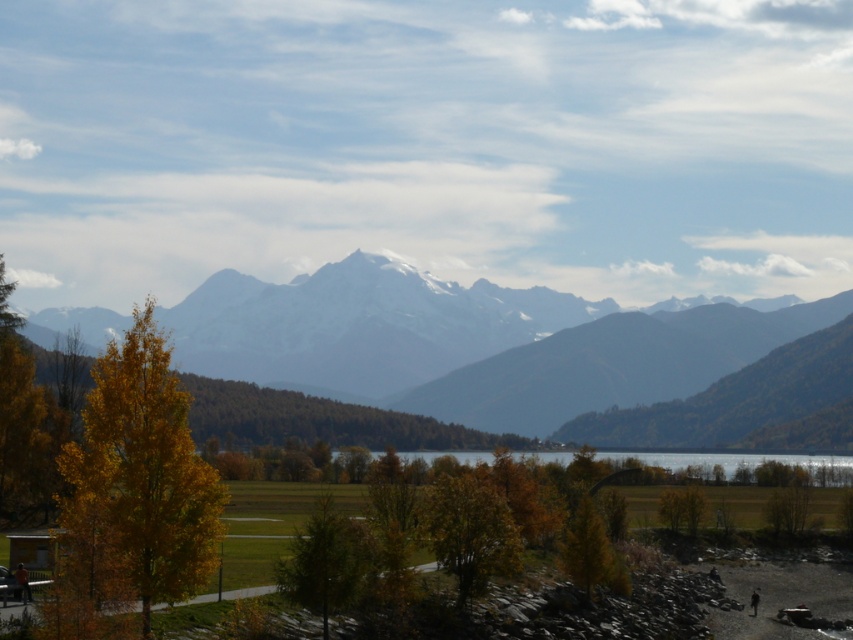
Is green matte tree at center taller than yellow matte tree at lower center?

Yes, green matte tree at center is taller than yellow matte tree at lower center.

Is point (299, 564) positioned before point (601, 572)?

Yes.

Locate an element on the screen. This screenshot has width=853, height=640. green matte tree at center is located at coordinates (326, 561).

Which is in front, point (483, 570) or point (376, 456)?

Point (483, 570)

Which of these two, golden-brown textured tree at center or clear glass lake at center, stands taller?

Standing taller between the two is clear glass lake at center.

Locate an element on the screen. golden-brown textured tree at center is located at coordinates (469, 531).

Is green matte tree at center shorter than clear glass lake at center?

Indeed, green matte tree at center has a lesser height compared to clear glass lake at center.

Is point (309, 584) more distant than point (822, 464)?

No, it is not.

Identify the location of green matte tree at center. (326, 561).